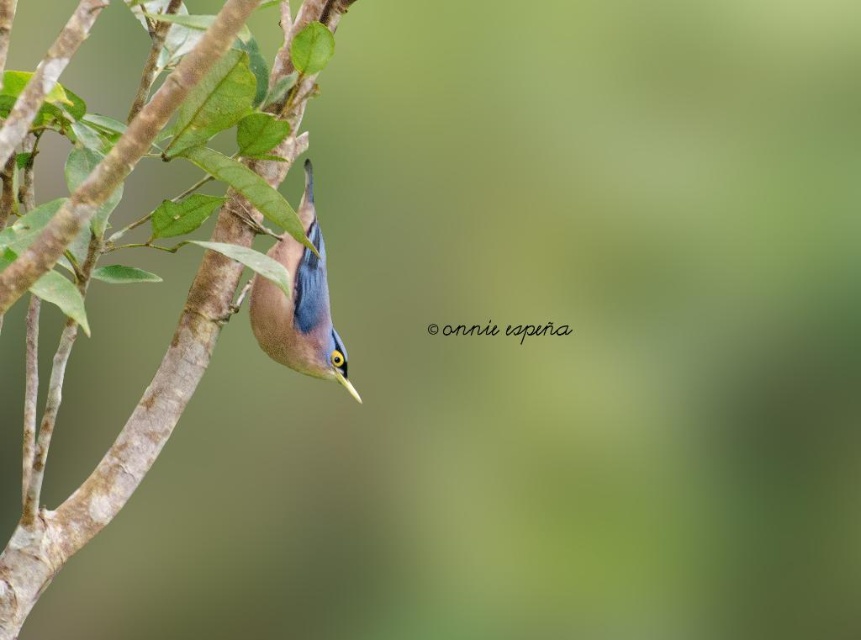
Measure the distance between smooth bark branch at center-left and camera.

smooth bark branch at center-left is 5.65 feet away from camera.

Can you confirm if smooth bark branch at center-left is wider than blue glossy bird at center-left?

Indeed, smooth bark branch at center-left has a greater width compared to blue glossy bird at center-left.

Is point (184, 397) positioned after point (304, 294)?

Yes, point (184, 397) is behind point (304, 294).

You are a GUI agent. You are given a task and a screenshot of the screen. Output one action in this format:
    pyautogui.click(x=<x>, y=<y>)
    Task: Click on the smooth bark branch at center-left
    
    Given the screenshot: What is the action you would take?
    pyautogui.click(x=119, y=451)